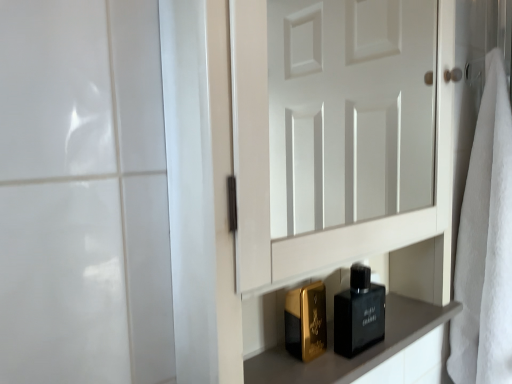
Image resolution: width=512 pixels, height=384 pixels. I want to click on free spot above matte black perfume bottles at lower center (from a real-world perspective), so click(365, 334).